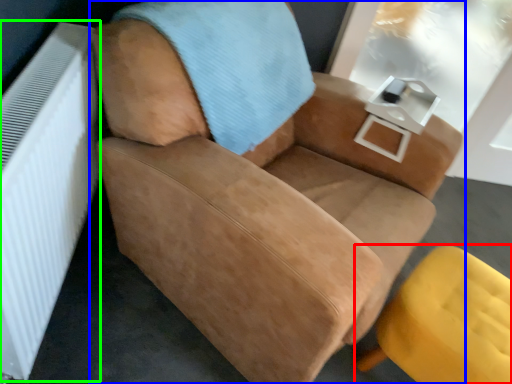
Question: Estimate the real-world distances between objects in this image. Which object is closer to chair (highlighted by a red box), chair (highlighted by a blue box) or radiator (highlighted by a green box)?

Choices:
 (A) chair
 (B) radiator

Answer: (A)